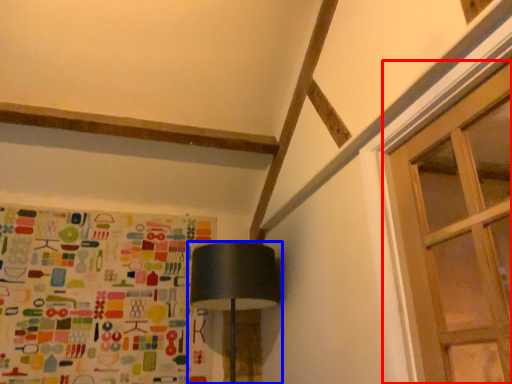
Question: Which of the following is the closest to the observer, window (highlighted by a red box) or lamp (highlighted by a blue box)?

Choices:
 (A) window
 (B) lamp

Answer: (A)